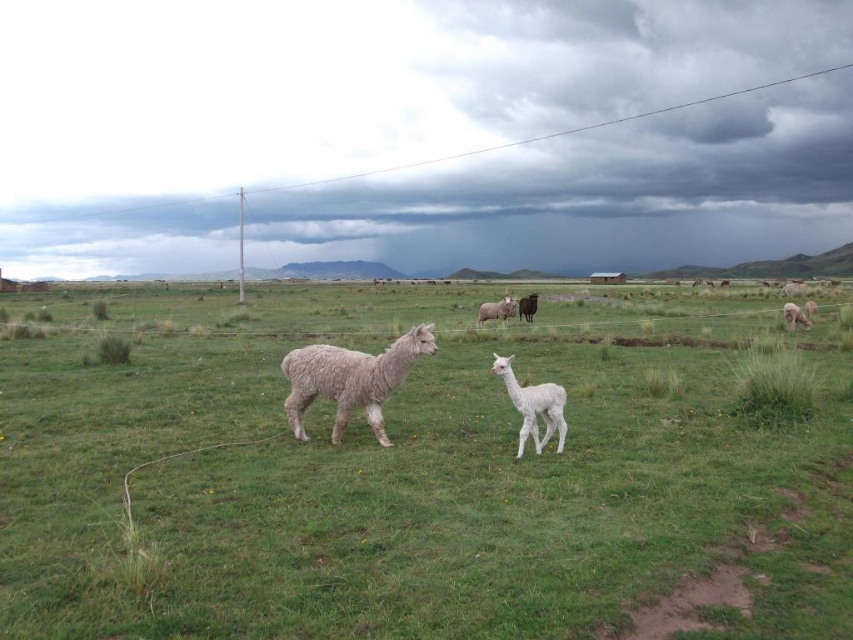
Question: Which point is closer to the camera taking this photo?

Choices:
 (A) (547, 410)
 (B) (306, 17)
 (C) (288, 314)

Answer: (A)

Question: Is green soft grass at center further to camera compared to cloudy sky at upper center?

Choices:
 (A) yes
 (B) no

Answer: (B)

Question: Does green soft grass at center appear over white woolly alpaca at center?

Choices:
 (A) yes
 (B) no

Answer: (A)

Question: Which point is closer to the camera?

Choices:
 (A) white woolly alpaca at center
 (B) green soft grass at center
 (C) fuzzy white alpaca at center

Answer: (B)

Question: In this image, where is green soft grass at center located relative to cloudy sky at upper center?

Choices:
 (A) above
 (B) below

Answer: (B)

Question: Which object is closer to the camera taking this photo?

Choices:
 (A) green soft grass at center
 (B) cloudy sky at upper center

Answer: (A)